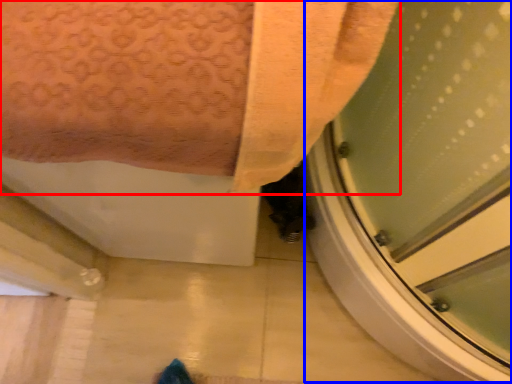
Question: Which object appears closest to the camera in this image, towel (highlighted by a red box) or screen door (highlighted by a blue box)?

Choices:
 (A) towel
 (B) screen door

Answer: (A)